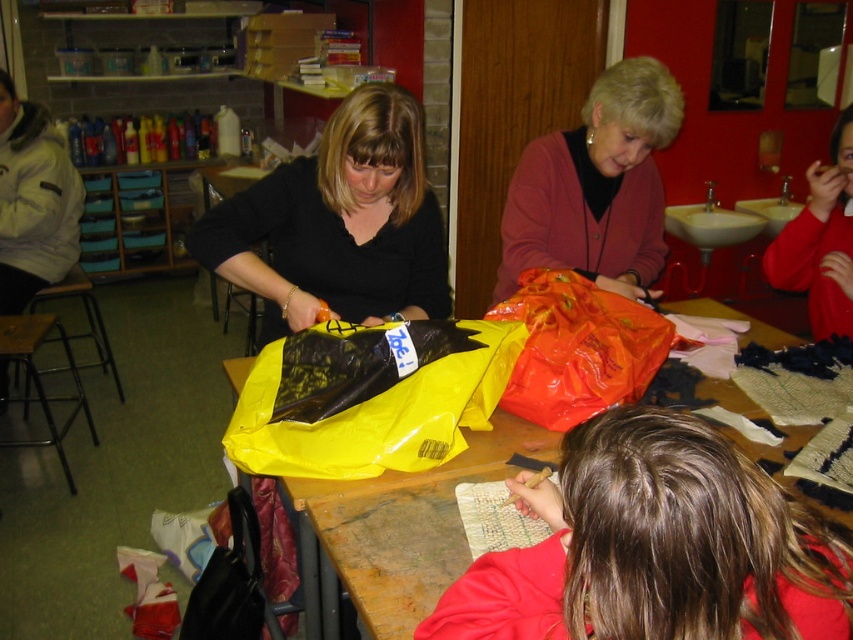
In the scene shown: You are a photographer positioned in front of the wooden table. You notice the matte black shirt at center and the shiny plastic bag at center. Which object is closer to the camera?

The matte black shirt at center is above the shiny plastic bag at center, so it is closer to the camera.

You are a student who needs to place a 25 cm long ruler between the wooden table at center and the shiny plastic bag at center. Can the ruler fit entirely between them?

The distance between the wooden table at center and the shiny plastic bag at center is 24.82 centimeters. Since the ruler is 25 cm long, it cannot fit entirely between them as the space is slightly shorter than the ruler.

You are a photographer standing in the classroom and want to take a closeup photo of the wooden table at center. The camera can focus on objects within 3 feet. Can you take the photo without moving closer?

The wooden table at center is 3.59 feet from the camera, which is beyond the 3 feet focus range. Therefore, you cannot take the photo without moving closer.